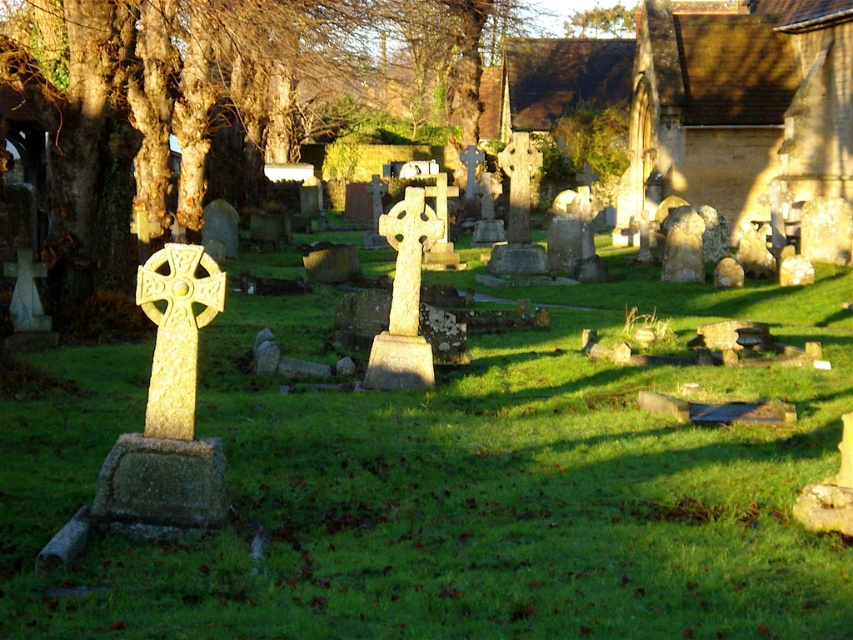
Question: Can you confirm if green grassy at center is bigger than golden stone cross at center?

Choices:
 (A) yes
 (B) no

Answer: (A)

Question: Can you confirm if green grassy at center is positioned to the left of golden stone cross at center?

Choices:
 (A) no
 (B) yes

Answer: (A)

Question: Is green grassy at center below stone textured church at upper right?

Choices:
 (A) no
 (B) yes

Answer: (B)

Question: Based on their relative distances, which object is nearer to the stone textured church at upper right?

Choices:
 (A) green grassy at center
 (B) golden stone cross at center
 (C) smooth bark tree at center

Answer: (A)

Question: Which of the following is the closest to the observer?

Choices:
 (A) (682, 81)
 (B) (363, 26)
 (C) (149, 584)

Answer: (C)

Question: Which of the following is the farthest from the observer?

Choices:
 (A) (816, 60)
 (B) (222, 285)

Answer: (A)